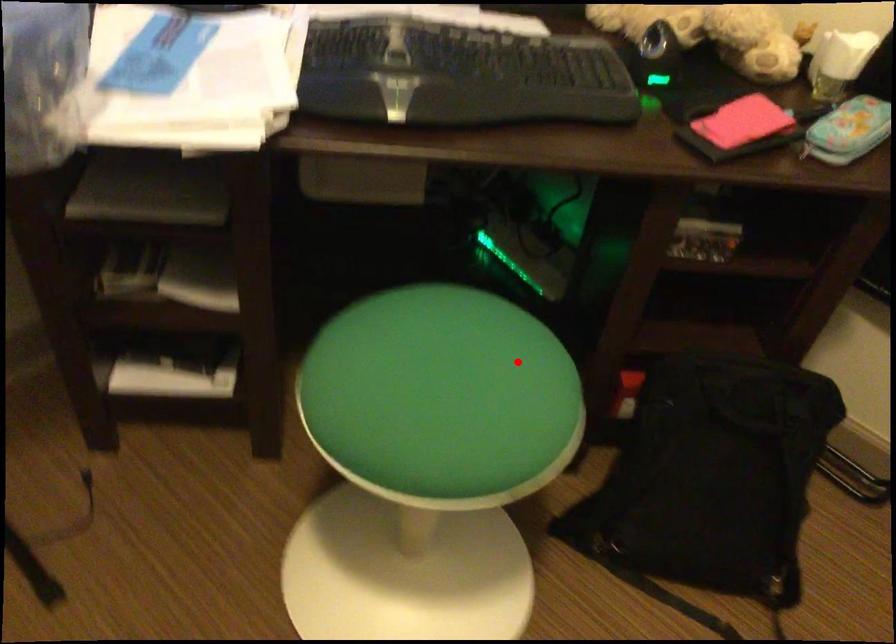
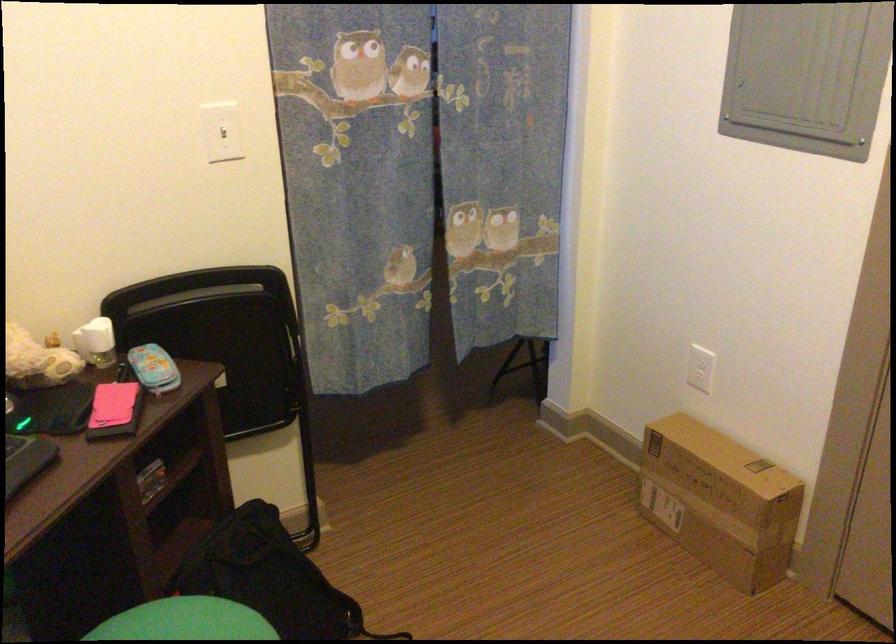
In the second image, find the point that corresponds to the highlighted location in the first image.

(185, 621)